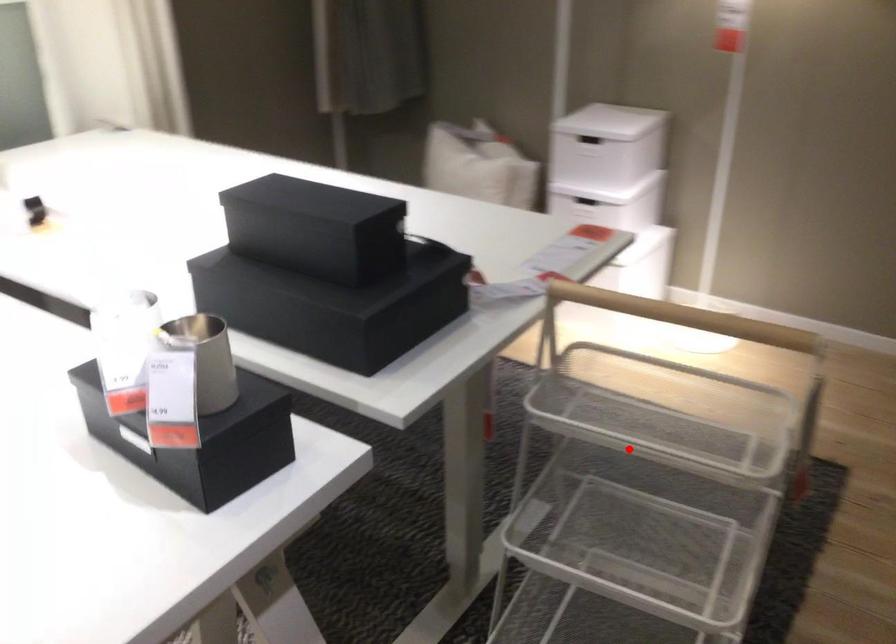
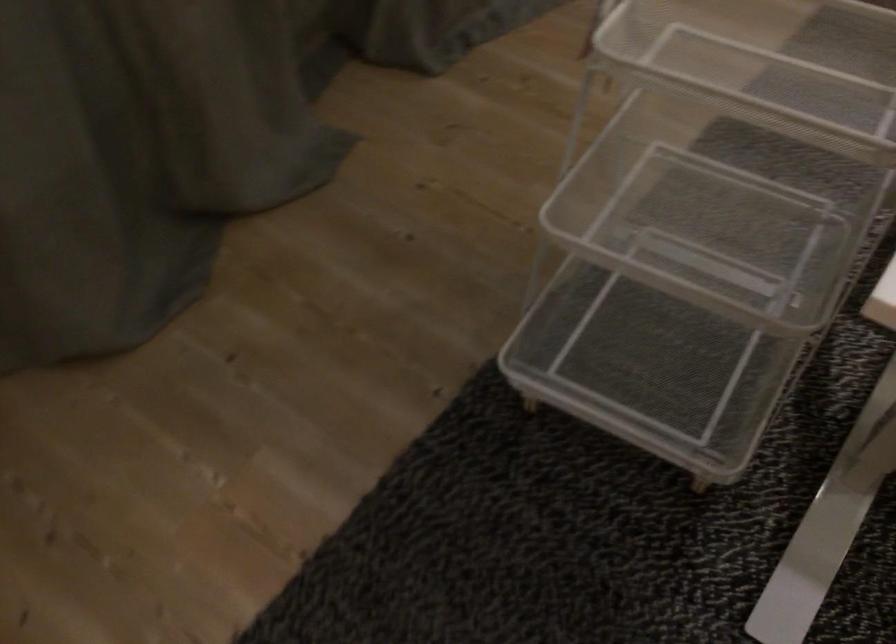
In the second image, find the point that corresponds to the highlighted location in the first image.

(806, 69)